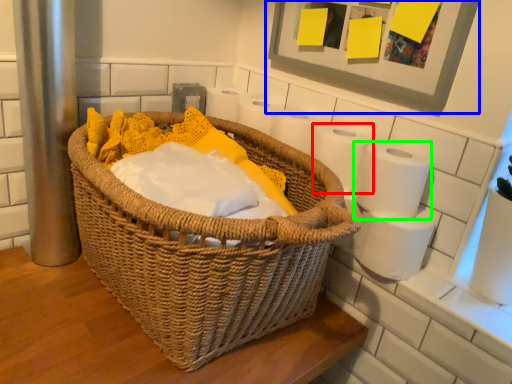
Question: Based on their relative distances, which object is nearer to toilet paper (highlighted by a red box)? Choose from picture frame (highlighted by a blue box) and toilet paper (highlighted by a green box).

Choices:
 (A) picture frame
 (B) toilet paper

Answer: (B)